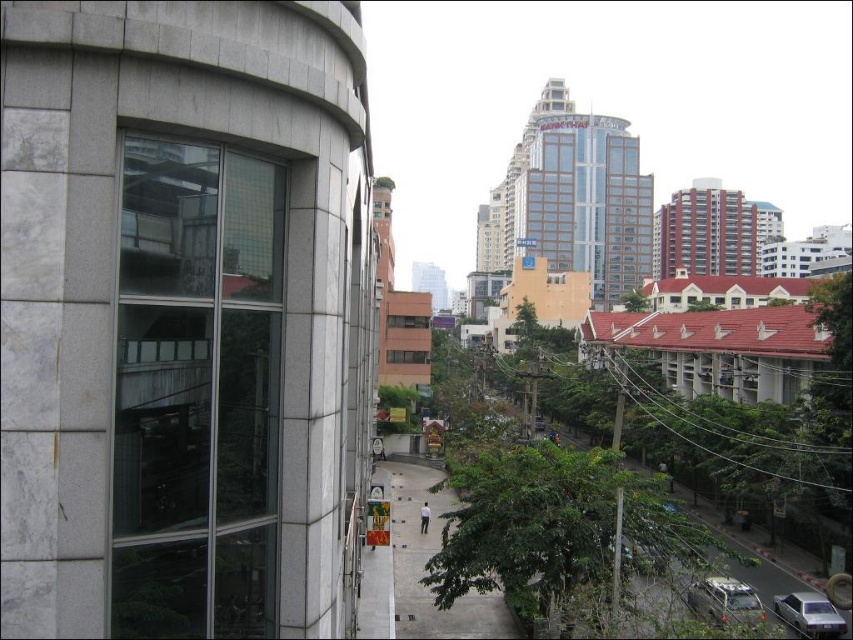
Who is higher up, metallic silver car at lower right or silver metallic sedan at bottom right?

metallic silver car at lower right is above.

Which of these two, metallic silver car at lower right or silver metallic sedan at bottom right, stands shorter?

silver metallic sedan at bottom right is shorter.

Is point (695, 612) positioned after point (788, 621)?

No, (695, 612) is closer to viewer.

In order to click on metallic silver car at lower right in this screenshot , I will do `click(724, 600)`.

Is transparent glass window at left above silver metallic sedan at bottom right?

Correct, transparent glass window at left is located above silver metallic sedan at bottom right.

Who is lower down, transparent glass window at left or silver metallic sedan at bottom right?

silver metallic sedan at bottom right is below.

Between point (173, 369) and point (805, 634), which one is positioned in front?

Point (173, 369) is in front.

Where is `transparent glass window at left`? The image size is (853, 640). transparent glass window at left is located at coordinates (196, 392).

Does transparent glass window at left appear on the left side of metallic silver car at lower right?

Indeed, transparent glass window at left is positioned on the left side of metallic silver car at lower right.

Does transparent glass window at left appear under metallic silver car at lower right?

No.

Where is `transparent glass window at left`? The image size is (853, 640). transparent glass window at left is located at coordinates 196,392.

Locate an element on the screen. This screenshot has width=853, height=640. transparent glass window at left is located at coordinates (196, 392).